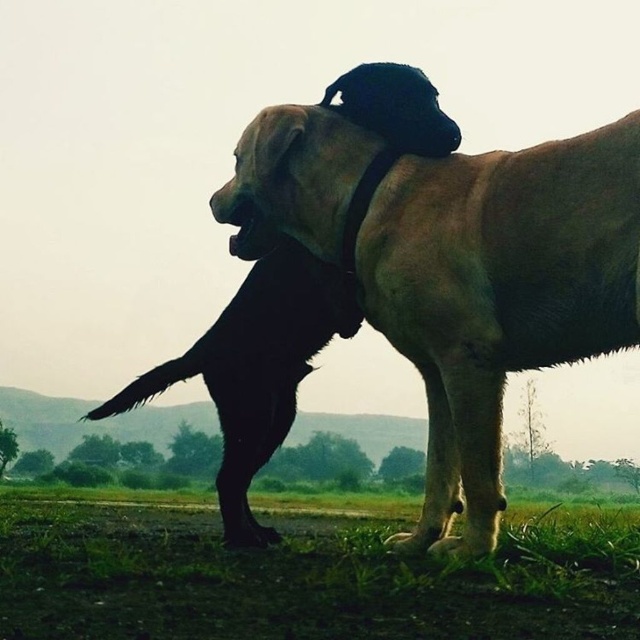
Between light brown fur dog at center and fuzzy beige paw at lower center, which one has less height?

With less height is fuzzy beige paw at lower center.

Is light brown fur dog at center to the left of fuzzy beige paw at lower center from the viewer's perspective?

Correct, you'll find light brown fur dog at center to the left of fuzzy beige paw at lower center.

Consider the image. Who is more forward, (237, 346) or (394, 538)?

Point (394, 538) is in front.

This screenshot has height=640, width=640. Find the location of `light brown fur dog at center`. light brown fur dog at center is located at coordinates (256, 362).

Does point (477, 454) lie in front of point (436, 532)?

Yes, it is in front of point (436, 532).

This screenshot has width=640, height=640. What are the coordinates of `light brown fur at center` in the screenshot? It's located at (429, 282).

This screenshot has height=640, width=640. In order to click on light brown fur at center in this screenshot , I will do `click(429, 282)`.

Is point (561, 289) closer to camera compared to point (266, 280)?

Yes, point (561, 289) is closer to viewer.

This screenshot has height=640, width=640. Identify the location of light brown fur at center. (429, 282).

Is point (614, 132) positioned before point (380, 96)?

Yes, point (614, 132) is in front of point (380, 96).

Find the location of a particular element. Image resolution: width=640 pixels, height=640 pixels. light brown fur at center is located at coordinates (429, 282).